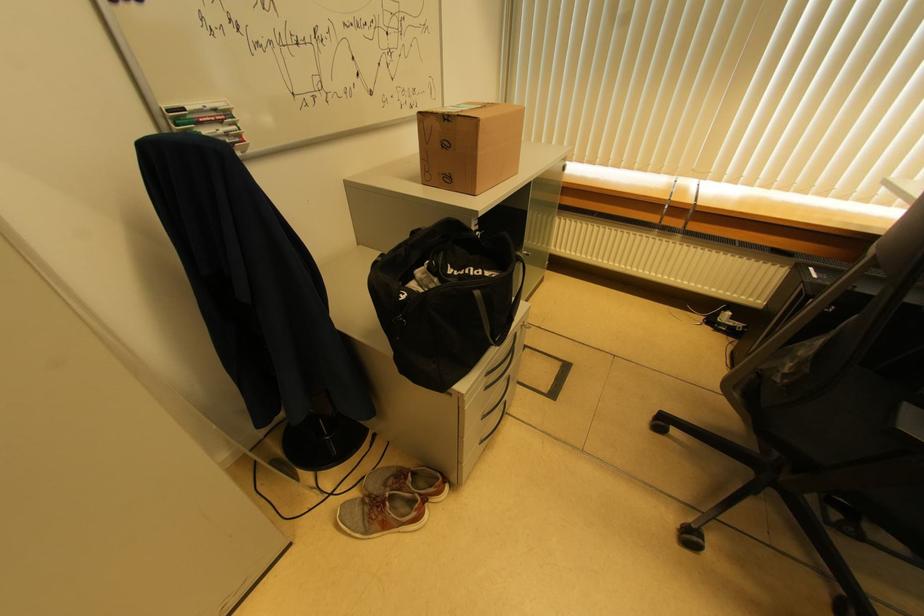
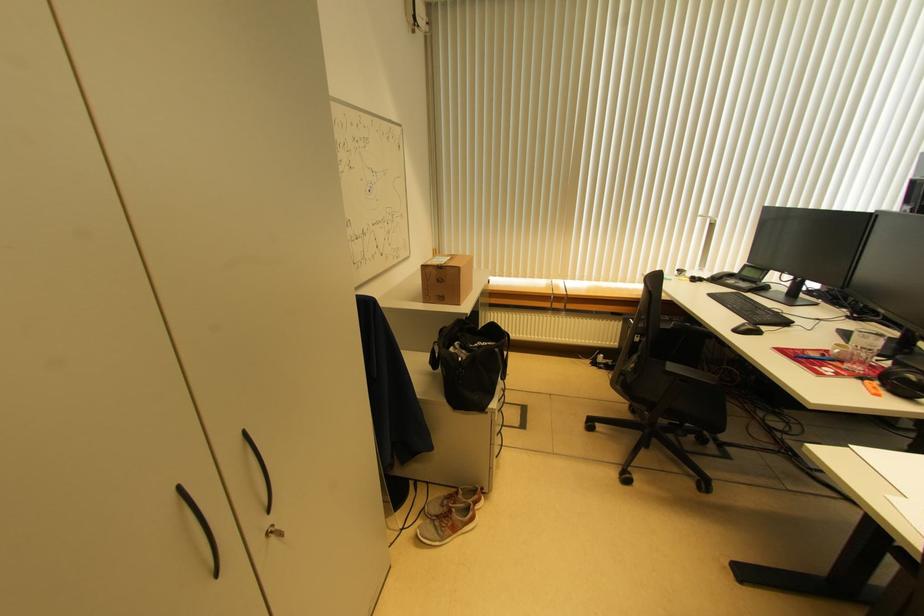
Find the pixel in the second image that matches the point at 477,124 in the first image.

(459, 272)